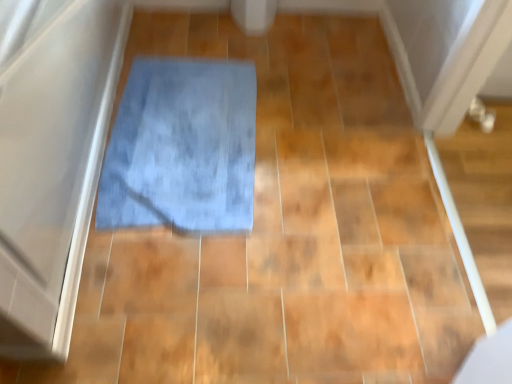
Question: Considering the positions of blue soft bath mat at center and transparent plastic screen door at left in the image, is blue soft bath mat at center bigger or smaller than transparent plastic screen door at left?

Choices:
 (A) big
 (B) small

Answer: (B)

Question: Based on their positions, is blue soft bath mat at center located to the left or right of transparent plastic screen door at left?

Choices:
 (A) right
 (B) left

Answer: (A)

Question: From a real-world perspective, is blue soft bath mat at center physically located above or below transparent plastic screen door at left?

Choices:
 (A) below
 (B) above

Answer: (A)

Question: From a real-world perspective, is transparent plastic screen door at left above or below blue soft bath mat at center?

Choices:
 (A) above
 (B) below

Answer: (A)

Question: In the image, is transparent plastic screen door at left on the left side or the right side of blue soft bath mat at center?

Choices:
 (A) left
 (B) right

Answer: (A)

Question: Based on their sizes in the image, would you say transparent plastic screen door at left is bigger or smaller than blue soft bath mat at center?

Choices:
 (A) small
 (B) big

Answer: (B)

Question: From their relative heights in the image, would you say transparent plastic screen door at left is taller or shorter than blue soft bath mat at center?

Choices:
 (A) tall
 (B) short

Answer: (A)